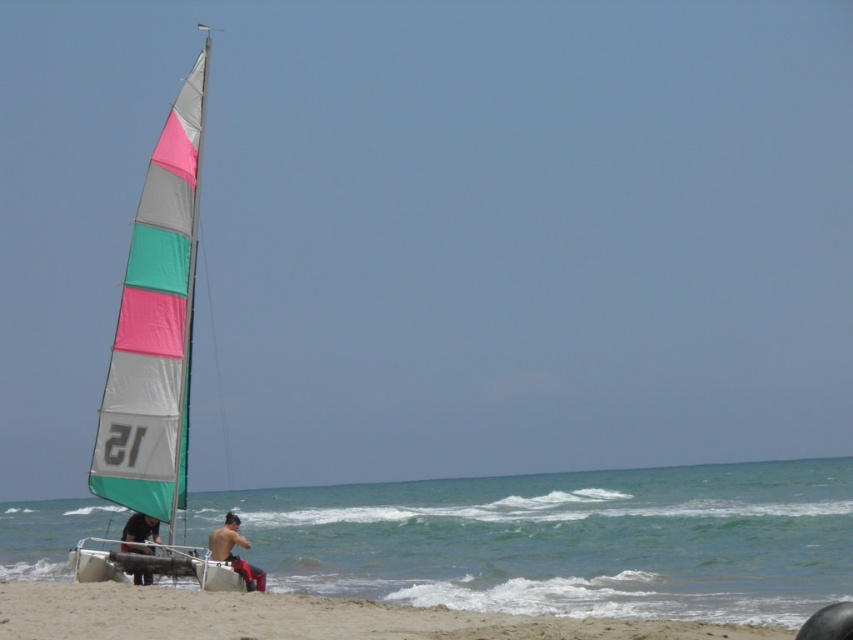
You are standing at the origin point of the coordinate system where the bottom left corner of the image is the origin. You want to locate the green water at lower left. What are its coordinates?

The green water at lower left is located at coordinates point [564,540].

You are a lifeguard standing at the edge of the sandy beach at lower left and want to reach the green water at lower left as quickly as possible. What is the shortest distance you need to cover?

The shortest distance between the sandy beach at lower left and the green water at lower left is 69.40 meters.

You are standing on the beach and see the green water at lower left and the shiny red shorts at lower center. Which object is closer to you?

The green water at lower left is closer to you because it is in front of the shiny red shorts at lower center.